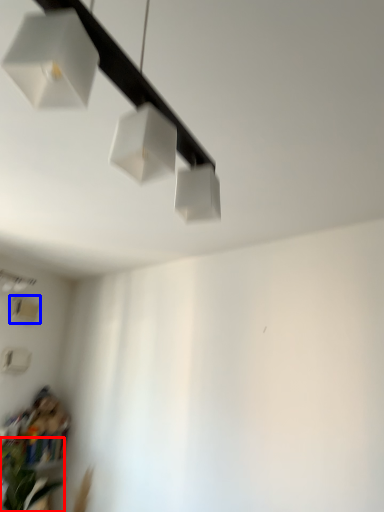
Question: Which object appears closest to the camera in this image, plant (highlighted by a red box) or lamp (highlighted by a blue box)?

Choices:
 (A) plant
 (B) lamp

Answer: (A)